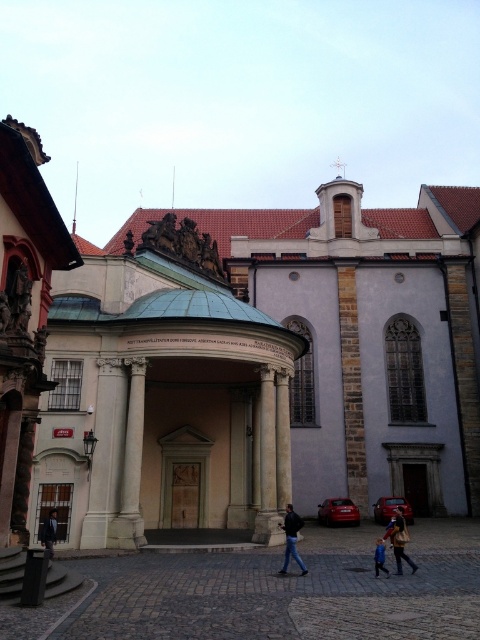
You are standing in the courtyard of a historical building and notice a point marked at coordinates (259, 360). Based on the scene description, what architectural feature is located at this point?

The point at coordinates (259, 360) indicates the location of the stone church at center.

In the scene shown: You are an architect visiting this historical site. You need to hang a brown leather jacket at lower center on the dark brown wooden door at center. Can the door accommodate the jacket horizontally?

The dark brown wooden door at center is narrower than the brown leather jacket at lower center, so the jacket cannot be hung horizontally without overlapping the door edges.